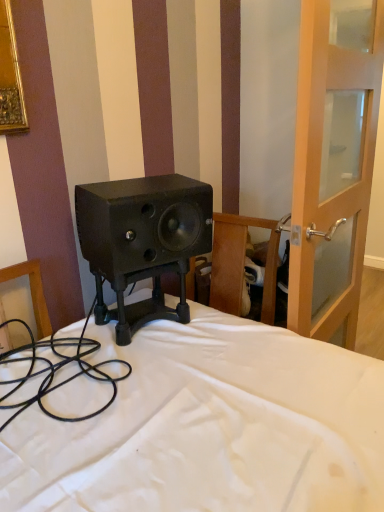
Question: From a real-world perspective, is transparent glass door at right below black rubber cable at lower left?

Choices:
 (A) yes
 (B) no

Answer: (B)

Question: Does transparent glass door at right have a lesser height compared to black rubber cable at lower left?

Choices:
 (A) yes
 (B) no

Answer: (B)

Question: Is transparent glass door at right positioned far away from black rubber cable at lower left?

Choices:
 (A) yes
 (B) no

Answer: (B)

Question: Does transparent glass door at right lie behind black rubber cable at lower left?

Choices:
 (A) yes
 (B) no

Answer: (A)

Question: From a real-world perspective, is transparent glass door at right on black rubber cable at lower left?

Choices:
 (A) no
 (B) yes

Answer: (B)

Question: Is transparent glass door at right not within black rubber cable at lower left?

Choices:
 (A) no
 (B) yes

Answer: (B)

Question: Could you tell me if black rubber cable at lower left is turned towards transparent glass door at right?

Choices:
 (A) yes
 (B) no

Answer: (B)

Question: Can you confirm if black rubber cable at lower left is shorter than transparent glass door at right?

Choices:
 (A) no
 (B) yes

Answer: (B)

Question: Is black rubber cable at lower left smaller than transparent glass door at right?

Choices:
 (A) no
 (B) yes

Answer: (B)

Question: Considering the relative sizes of black rubber cable at lower left and transparent glass door at right in the image provided, is black rubber cable at lower left thinner than transparent glass door at right?

Choices:
 (A) no
 (B) yes

Answer: (A)

Question: Is black rubber cable at lower left next to transparent glass door at right and touching it?

Choices:
 (A) no
 (B) yes

Answer: (A)

Question: Is black rubber cable at lower left looking in the opposite direction of transparent glass door at right?

Choices:
 (A) yes
 (B) no

Answer: (B)

Question: Considering the relative sizes of black matte speaker at center and transparent glass door at right in the image provided, is black matte speaker at center bigger than transparent glass door at right?

Choices:
 (A) no
 (B) yes

Answer: (A)